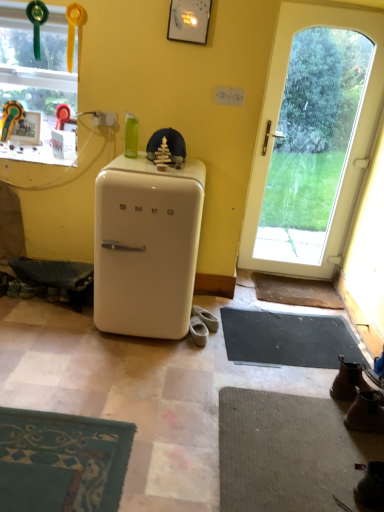
What is the approximate height of beige suede shoes at lower center, which is counted as the first footwear, starting from the top?

2.71 inches.

Describe the element at coordinates (288, 338) in the screenshot. I see `black rubber yoga mat at lower right` at that location.

Image resolution: width=384 pixels, height=512 pixels. Describe the element at coordinates (296, 291) in the screenshot. I see `brown leather doormat at lower right` at that location.

You are a GUI agent. You are given a task and a screenshot of the screen. Output one action in this format:
    pyautogui.click(x=<x>, y=<y>)
    Task: Click on the white glass door at right
    
    Given the screenshot: What is the action you would take?
    pyautogui.click(x=277, y=121)

This screenshot has height=512, width=384. Describe the element at coordinates (277, 121) in the screenshot. I see `white glass door at right` at that location.

Locate an element on the screen. This screenshot has height=512, width=384. beige suede shoes at lower center, the third footwear positioned from the right is located at coordinates (198, 331).

Does point (312, 294) appear closer or farther from the camera than point (224, 314)?

Point (312, 294).

Is brown leather doormat at lower right wider than black rubber yoga mat at lower right?

In fact, brown leather doormat at lower right might be narrower than black rubber yoga mat at lower right.

How different are the orientations of brown leather doormat at lower right and black rubber yoga mat at lower right in degrees?

There is a 4.58-degree angle between the facing directions of brown leather doormat at lower right and black rubber yoga mat at lower right.

From a real-world perspective, which is physically above, brown leather doormat at lower right or black rubber yoga mat at lower right?

brown leather doormat at lower right is physically above.

Between beige suede shoes at lower center, the third footwear positioned from the right, and black rubber yoga mat at lower right, which one has larger size?

black rubber yoga mat at lower right.

Could you tell me if beige suede shoes at lower center, the second footwear from the bottom, is facing black rubber yoga mat at lower right?

No, beige suede shoes at lower center, the second footwear from the bottom, does not turn towards black rubber yoga mat at lower right.

Considering the positions of objects beige suede shoes at lower center, which is the 2th footwear from top to bottom, and black rubber yoga mat at lower right in the image provided, who is more to the left, beige suede shoes at lower center, which is the 2th footwear from top to bottom, or black rubber yoga mat at lower right?

From the viewer's perspective, beige suede shoes at lower center, which is the 2th footwear from top to bottom, appears more on the left side.

From the image's perspective, which one is positioned lower, white glass door at right or brown leather doormat at lower right?

brown leather doormat at lower right, from the image's perspective.

From a real-world perspective, which object rests below the other?

brown leather doormat at lower right.

Considering their positions, is white glass door at right located in front of or behind brown leather doormat at lower right?

Clearly, white glass door at right is in front of brown leather doormat at lower right.

Is beige suede shoes at lower center, the second footwear viewed from the back, at the left side of brown leather doormat at lower right?

Correct, you'll find beige suede shoes at lower center, the second footwear viewed from the back, to the left of brown leather doormat at lower right.

Is beige suede shoes at lower center, the third footwear positioned from the right, taller than brown leather doormat at lower right?

Correct, beige suede shoes at lower center, the third footwear positioned from the right, is much taller as brown leather doormat at lower right.

Identify the location of footwear that is the 2nd object above the brown leather doormat at lower right (from a real-world perspective). The width and height of the screenshot is (384, 512). (198, 331).

Looking at their sizes, would you say beige suede shoes at lower center, the third footwear positioned from the right, is wider or thinner than brown leather doormat at lower right?

beige suede shoes at lower center, the third footwear positioned from the right, is thinner than brown leather doormat at lower right.

Can you confirm if black rubber yoga mat at lower right is bigger than transparent glass window at upper left?

Actually, black rubber yoga mat at lower right might be smaller than transparent glass window at upper left.

Would you say black rubber yoga mat at lower right is to the left or to the right of transparent glass window at upper left in the picture?

From the image, it's evident that black rubber yoga mat at lower right is to the right of transparent glass window at upper left.

Can you confirm if black rubber yoga mat at lower right is taller than transparent glass window at upper left?

No.

Looking at this image, is black rubber yoga mat at lower right not near transparent glass window at upper left?

Yes, black rubber yoga mat at lower right and transparent glass window at upper left are located far from each other.

From a real-world perspective, between white matte refrigerator at center and white glass door at right, who is vertically lower?

In real-world perspective, white matte refrigerator at center is lower.

Between point (106, 245) and point (254, 225), which one is positioned behind?

The point (254, 225) is farther from the camera.

In terms of size, does white matte refrigerator at center appear bigger or smaller than white glass door at right?

Clearly, white matte refrigerator at center is larger in size than white glass door at right.

From the image's perspective, which one is positioned lower, brown leather boot at lower right, the third footwear viewed from the back, or white matte refrigerator at center?

From the image's view, brown leather boot at lower right, the third footwear viewed from the back, is below.

Is brown leather boot at lower right, the third footwear positioned from the top, wider than white matte refrigerator at center?

Incorrect, the width of brown leather boot at lower right, the third footwear positioned from the top, does not surpass that of white matte refrigerator at center.

Between point (369, 397) and point (173, 189), which one is positioned behind?

The point (173, 189) is farther.

Can white matte refrigerator at center be found inside brown leather boot at lower right, which appears as the third footwear when viewed from the left?

Definitely not — white matte refrigerator at center is not inside brown leather boot at lower right, which appears as the third footwear when viewed from the left.

Find the location of a particular element. This screenshot has width=384, height=512. yoga mat in front of the brown leather doormat at lower right is located at coordinates (288, 338).

Starting from the black rubber yoga mat at lower right, which footwear is the 2nd one to the left? Please provide its 2D coordinates.

[(198, 331)]

Looking at the image, which one is located further to white matte refrigerator at center, white glass door at right or black rubber yoga mat at lower right?

white glass door at right is further to white matte refrigerator at center.

From the image, which object appears to be farther from white glass door at right, brown leather doormat at lower right or transparent glass window at upper left?

transparent glass window at upper left lies further to white glass door at right than the other object.

From the image, which object appears to be farther from black rubber yoga mat at lower right, brown leather doormat at lower right or beige suede shoes at lower center, the third footwear positioned from the right?

Among the two, beige suede shoes at lower center, the third footwear positioned from the right, is located further to black rubber yoga mat at lower right.

Looking at this image, from the image, which object appears to be farther from transparent glass window at upper left, brown leather boot at lower right, the third footwear positioned from the top, or brown leather doormat at lower right?

Among the two, brown leather boot at lower right, the third footwear positioned from the top, is located further to transparent glass window at upper left.

Looking at the image, which one is located closer to beige suede shoes at lower center, which ranks as the 1th footwear in back-to-front order, white glass door at right or transparent glass window at upper left?

The object closer to beige suede shoes at lower center, which ranks as the 1th footwear in back-to-front order, is white glass door at right.

Looking at this image, based on their spatial positions, is white matte refrigerator at center or beige suede shoes at lower center, the third footwear positioned from the bottom, closer to transparent glass window at upper left?

white matte refrigerator at center lies closer to transparent glass window at upper left than the other object.

Which object lies nearer to the anchor point brown leather boot at lower right, the third footwear viewed from the back, beige suede shoes at lower center, the 2th footwear when ordered from right to left, or beige suede shoes at lower center, the second footwear from the bottom?

beige suede shoes at lower center, the second footwear from the bottom, is positioned closer to the anchor brown leather boot at lower right, the third footwear viewed from the back.

Looking at the image, which one is located closer to brown leather doormat at lower right, transparent glass window at upper left or black rubber yoga mat at lower right?

black rubber yoga mat at lower right is positioned closer to the anchor brown leather doormat at lower right.

This screenshot has width=384, height=512. What are the coordinates of `doormat situated between transparent glass window at upper left and white glass door at right from left to right` in the screenshot? It's located at (296, 291).

Where is `yoga mat between white matte refrigerator at center and brown leather doormat at lower right in the horizontal direction`? yoga mat between white matte refrigerator at center and brown leather doormat at lower right in the horizontal direction is located at coordinates (288, 338).

Where is `footwear between beige suede shoes at lower center, which is the 2th footwear from top to bottom, and brown leather doormat at lower right, in the horizontal direction`? This screenshot has width=384, height=512. footwear between beige suede shoes at lower center, which is the 2th footwear from top to bottom, and brown leather doormat at lower right, in the horizontal direction is located at coordinates (205, 318).

You are a GUI agent. You are given a task and a screenshot of the screen. Output one action in this format:
    pyautogui.click(x=<x>, y=<y>)
    Task: Click on the yoga mat between white matte refrigerator at center and brown leather boot at lower right, the 1th footwear from the bottom, in the horizontal direction
    This screenshot has width=384, height=512.
    Given the screenshot: What is the action you would take?
    pyautogui.click(x=288, y=338)